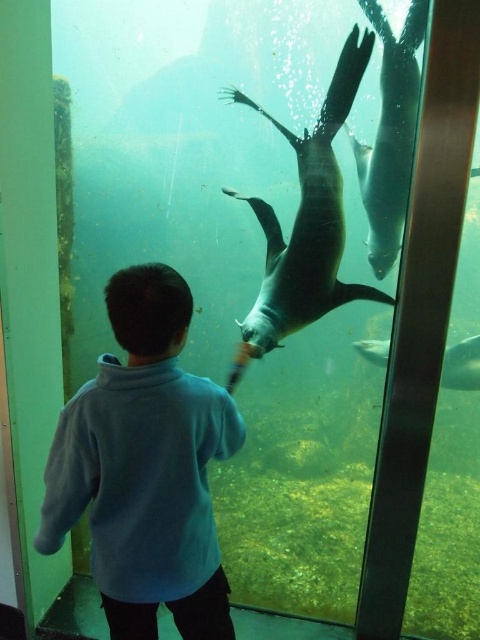
You are a visitor at the aquarium and you see the gray matte penguin at upper right and the shiny silver fish at center. Which one is closer to the left side of the tank?

The gray matte penguin at upper right is to the left of the shiny silver fish at center, so it is closer to the left side of the tank.

You are a marine biologist observing the aquarium scene. You need to determine which object is larger between the blue fleece jacket at center and the shiny silver fish at center. Based on the scene description, which one is bigger?

The blue fleece jacket at center is bigger than the shiny silver fish at center.

You are standing in the aquarium and see a point marked at coordinates [144,467]. According to the scene description, what object is this point located on?

The point at coordinates [144,467] is located on the blue fleece jacket at center.